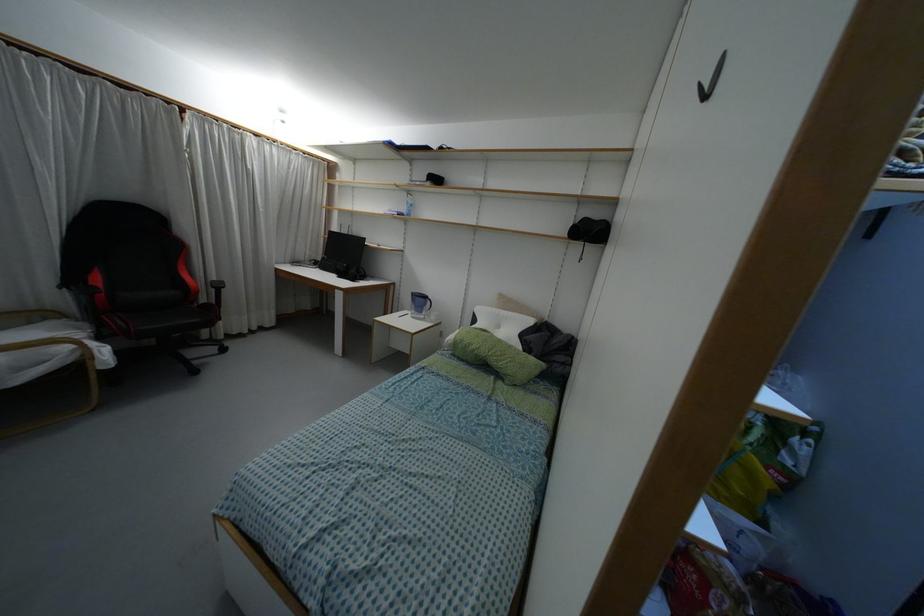
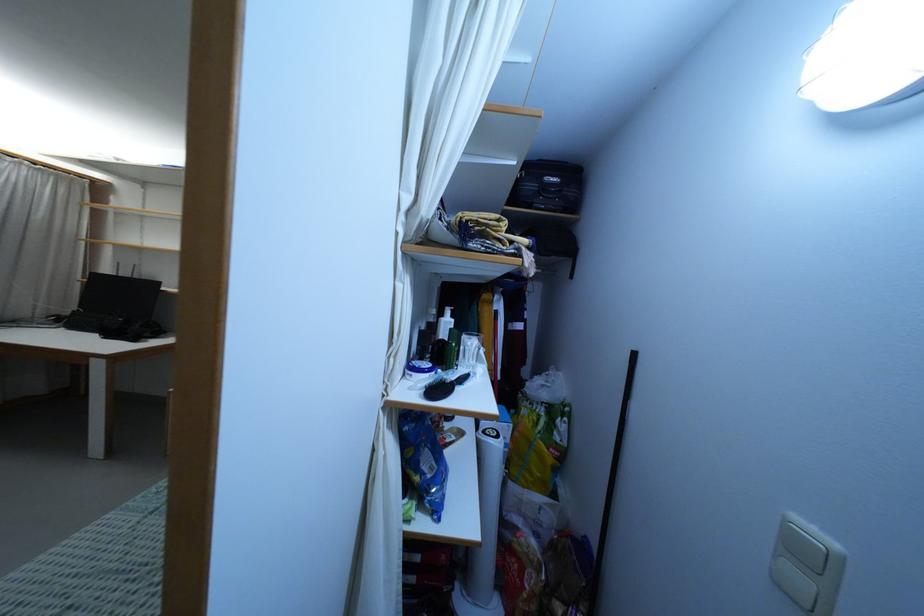
Question: I am providing you with two images of the same scene from different viewpoints. After the viewpoint changes to image2, which objects are now occluded?

Choices:
 (A) black wall hook
 (B) black hairbrush
 (C) white lotion bottle
 (D) utility cart handle

Answer: (A)